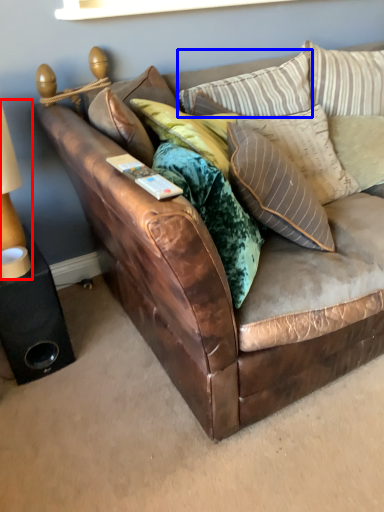
Question: Which point is further to the camera, table lamp (highlighted by a red box) or pillow (highlighted by a blue box)?

Choices:
 (A) table lamp
 (B) pillow

Answer: (B)